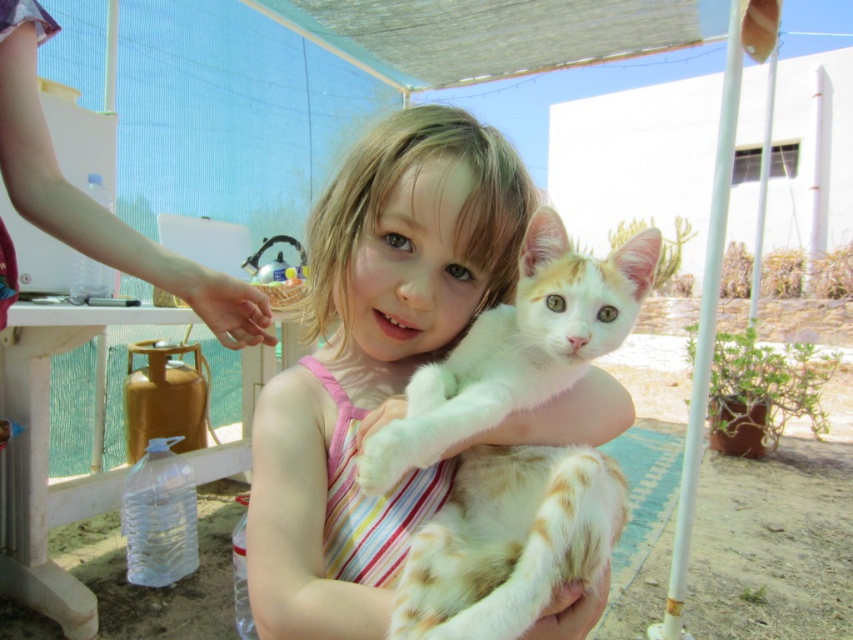
Between white soft fabric dress at center and white fluffy cat at center, which one has more height?

white soft fabric dress at center is taller.

Can you confirm if white soft fabric dress at center is wider than white fluffy cat at center?

Correct, the width of white soft fabric dress at center exceeds that of white fluffy cat at center.

In order to click on white soft fabric dress at center in this screenshot , I will do `click(374, 362)`.

The image size is (853, 640). Find the location of `white soft fabric dress at center`. white soft fabric dress at center is located at coordinates (374, 362).